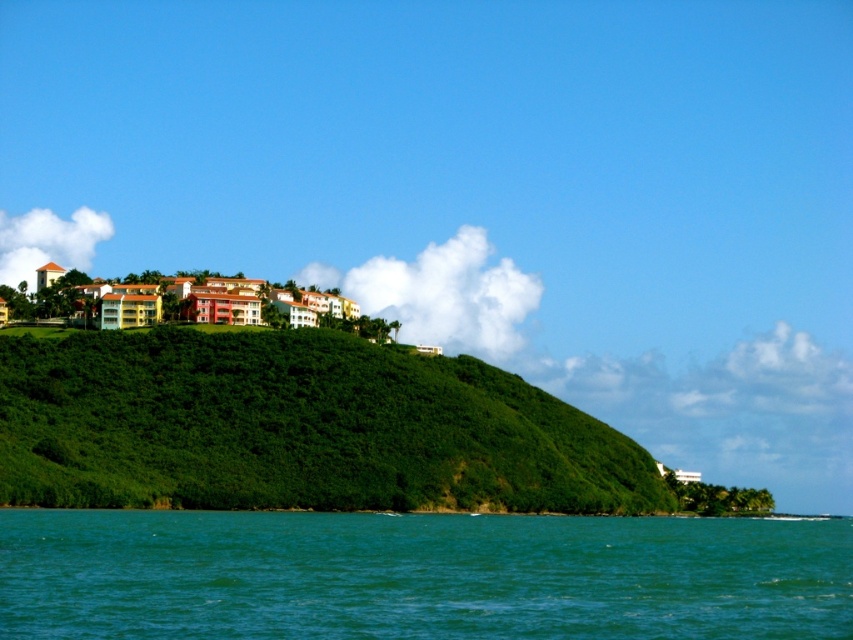
You are standing at the edge of the scene and want to locate the teal glossy water at lower center. According to the coordinates provided, in which direction should you look to find it?

The teal glossy water at lower center is located at coordinates point [419,576], so you should look towards the lower right direction to find it.

You are standing at the edge of the teal glossy water at lower center and want to walk to the green leafy hillside at center. Which direction should you head to reach the hillside?

To reach the green leafy hillside at center from the teal glossy water at lower center, you should head upward since the hillside is elevated compared to the water level.